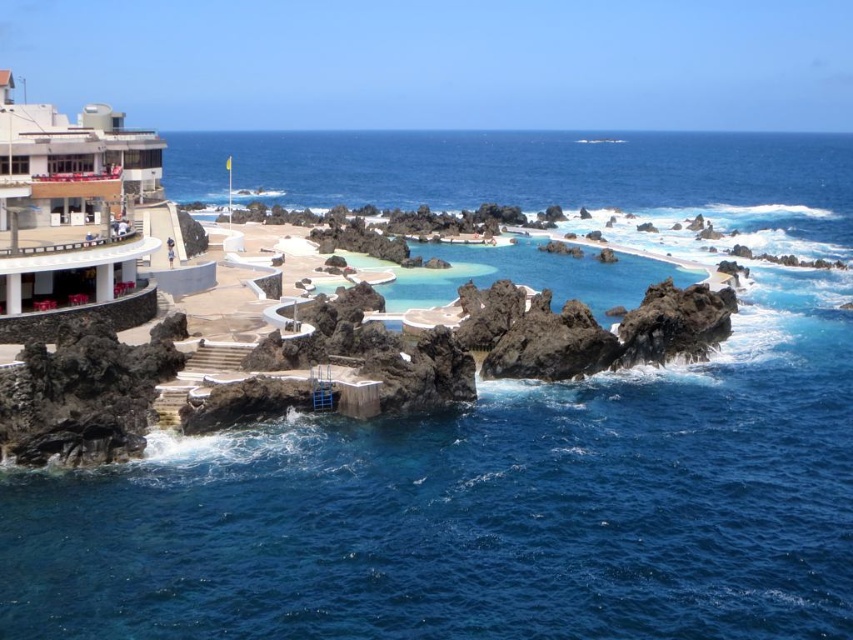
Question: Is white concrete building at upper left positioned in front of clear glass pool at center?

Choices:
 (A) yes
 (B) no

Answer: (A)

Question: Which point appears farthest from the camera in this image?

Choices:
 (A) pyautogui.click(x=0, y=74)
 (B) pyautogui.click(x=471, y=275)

Answer: (B)

Question: Which point is closer to the camera?

Choices:
 (A) (440, 296)
 (B) (93, 115)

Answer: (B)

Question: Is white concrete building at upper left wider than clear glass pool at center?

Choices:
 (A) yes
 (B) no

Answer: (B)

Question: Is white concrete building at upper left above clear glass pool at center?

Choices:
 (A) yes
 (B) no

Answer: (A)

Question: Which of the following is the farthest from the observer?

Choices:
 (A) white concrete building at upper left
 (B) clear glass pool at center

Answer: (B)